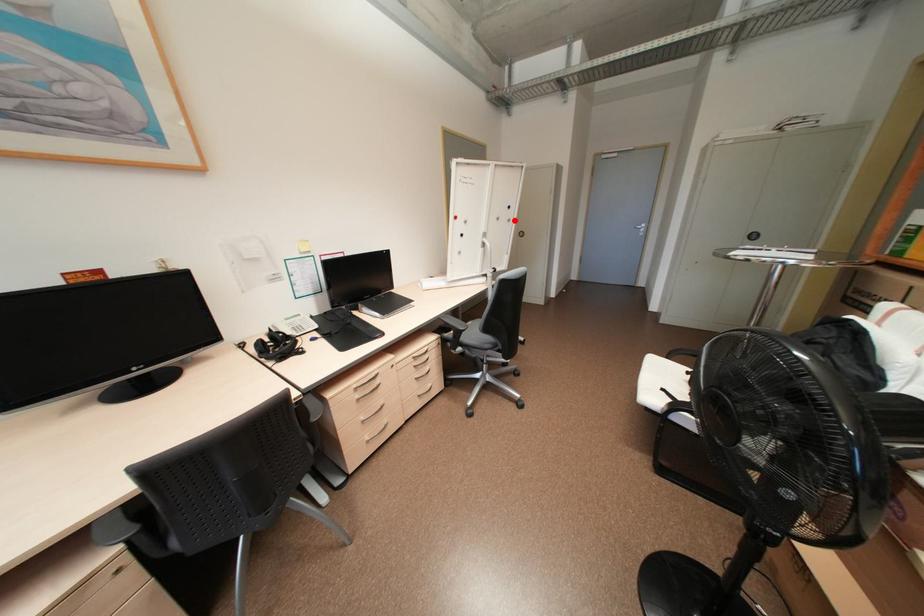
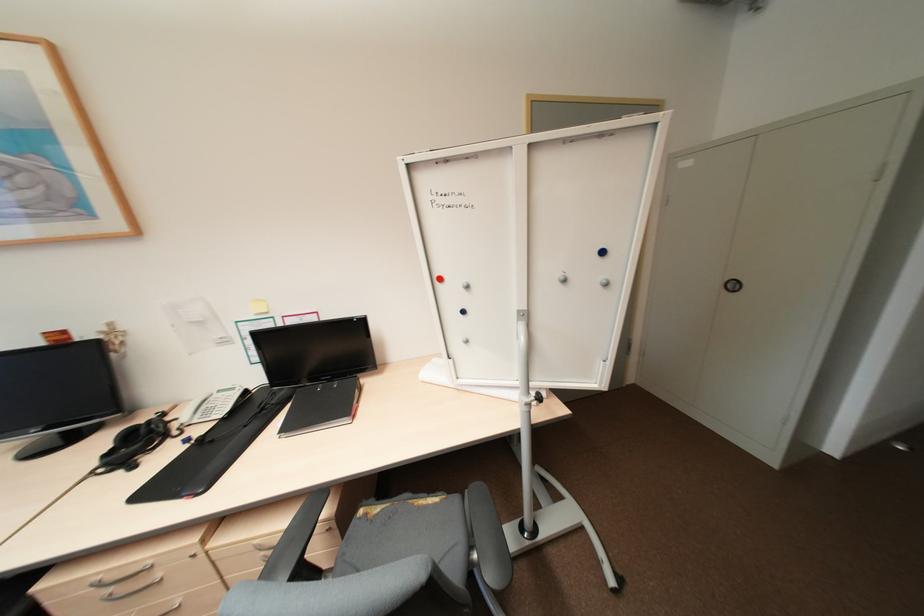
The point at the highlighted location is marked in the first image. Where is the corresponding point in the second image?

(612, 284)